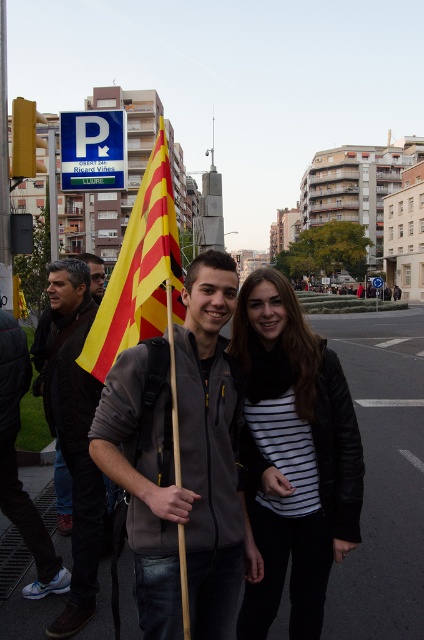
Question: Is striped fabric shirt at center to the right of dark gray jacket at center from the viewer's perspective?

Choices:
 (A) no
 (B) yes

Answer: (B)

Question: Does matte gray hoodie at center have a larger size compared to yellowstriped fabricflag at left?

Choices:
 (A) yes
 (B) no

Answer: (B)

Question: Which of these objects is positioned closest to the dark gray jacket at center?

Choices:
 (A) matte gray hoodie at center
 (B) yellowstriped fabricflag at left

Answer: (B)

Question: Which object is the farthest from the dark gray jacket at center?

Choices:
 (A) matte gray hoodie at center
 (B) yellowstriped fabricflag at left
 (C) striped fabric shirt at center

Answer: (C)

Question: Which of the following is the farthest from the observer?

Choices:
 (A) (198, 628)
 (B) (317, 572)
 (C) (151, 314)
 (D) (53, 352)

Answer: (D)

Question: Does matte gray hoodie at center have a lesser width compared to dark gray jacket at center?

Choices:
 (A) yes
 (B) no

Answer: (A)